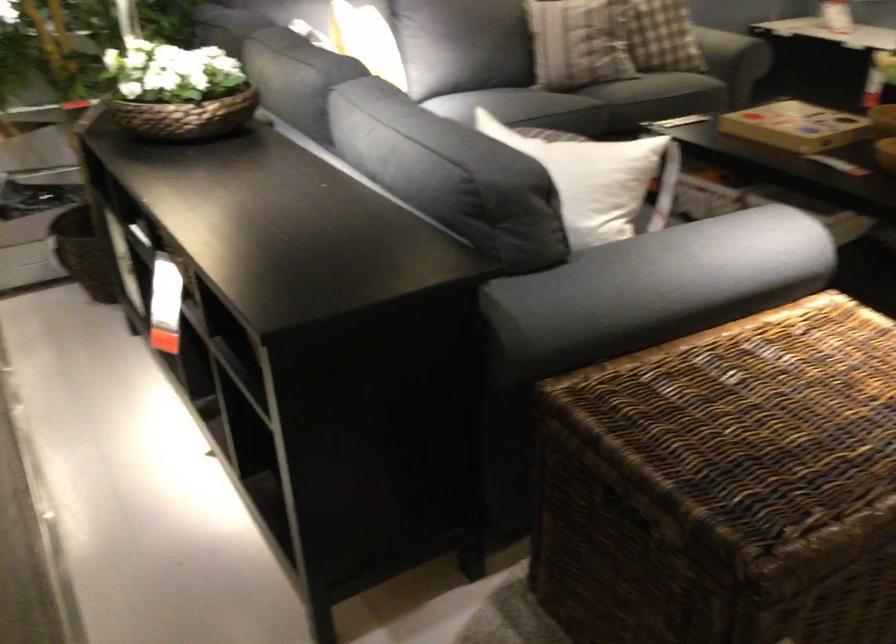
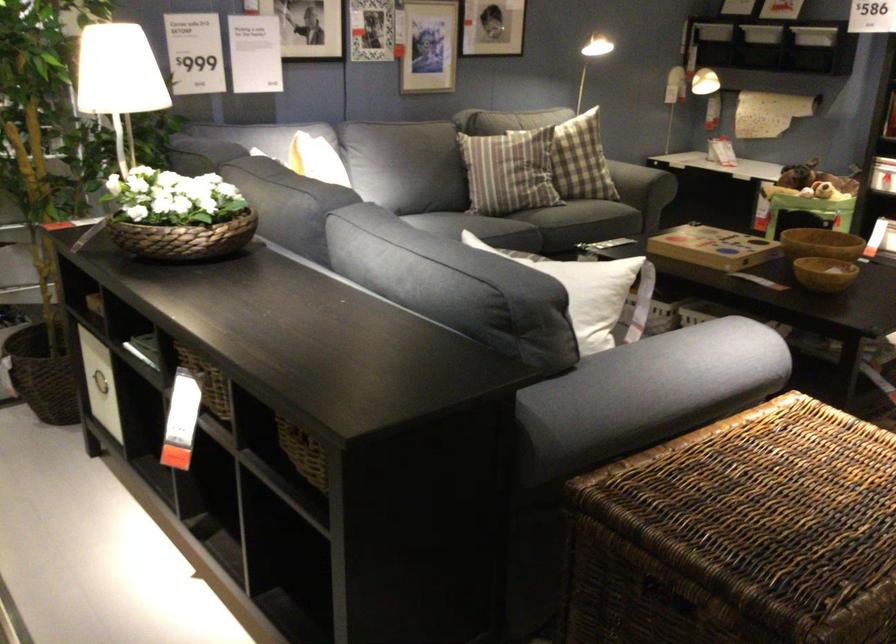
Where in the second image is the point corresponding to [169,88] from the first image?

(177, 216)